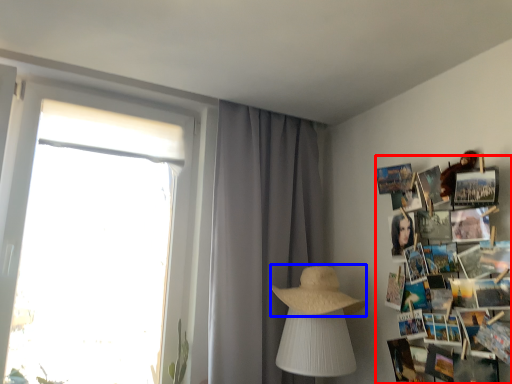
Question: Among these objects, which one is farthest to the camera, magazine (highlighted by a red box) or straw hat (highlighted by a blue box)?

Choices:
 (A) magazine
 (B) straw hat

Answer: (B)